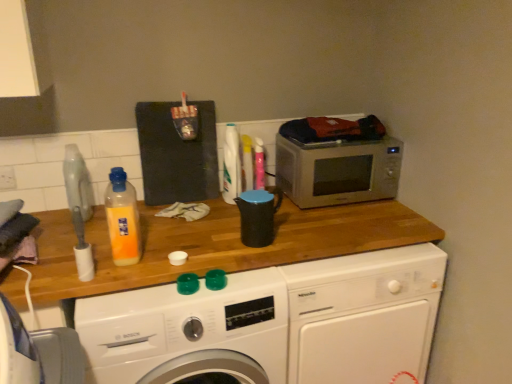
Question: Is satin silver microwave at upper right taller or shorter than white glossy washing machine at center, the second washing machine viewed from the left?

Choices:
 (A) short
 (B) tall

Answer: (A)

Question: Is satin silver microwave at upper right situated inside white glossy washing machine at center, positioned as the first washing machine in right-to-left order, or outside?

Choices:
 (A) outside
 (B) inside

Answer: (A)

Question: Which object is positioned farthest from the white plastic power plugs and sockets at upper left?

Choices:
 (A) black plastic kettle at center
 (B) white glossy washing machine at center, the first washing machine positioned from the left
 (C) translucent plastic bottle at center
 (D) white glossy washing machine at center, the second washing machine viewed from the left
 (E) satin silver microwave at upper right

Answer: (D)

Question: Estimate the real-world distances between objects in this image. Which object is farther from the satin silver microwave at upper right?

Choices:
 (A) white plastic power plugs and sockets at upper left
 (B) white glossy washing machine at center, the 2th washing machine in the right-to-left sequence
 (C) black plastic kettle at center
 (D) white glossy washing machine at center, positioned as the first washing machine in right-to-left order
 (E) translucent plastic bottle at center

Answer: (A)